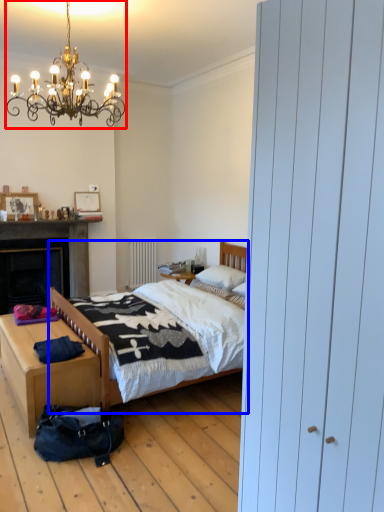
Question: Which object appears closest to the camera in this image, light fixture (highlighted by a red box) or bed (highlighted by a blue box)?

Choices:
 (A) light fixture
 (B) bed

Answer: (A)